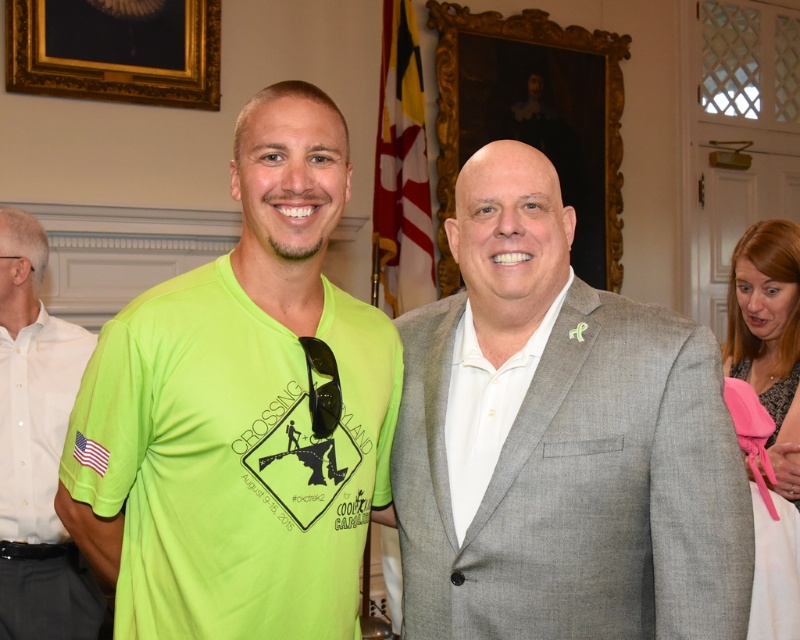
You are a photographer at a formal event and need to adjust the lighting to ensure both the gray suit at center and the white smooth shirt at center are visible. Which object should you focus on first to ensure proper exposure?

The gray suit at center is positioned under the white smooth shirt at center, so focusing on the white smooth shirt at center first would help balance the exposure since it is above and might be in a different lighting area.